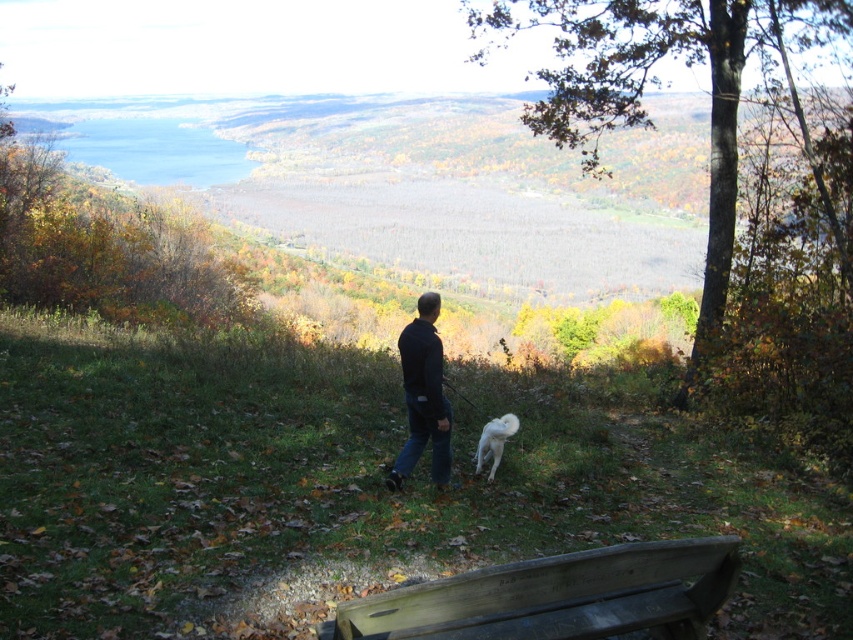
Question: Is black fabric jacket at center to the left of white fluffy dog at center from the viewer's perspective?

Choices:
 (A) yes
 (B) no

Answer: (A)

Question: Which point is farther to the camera?

Choices:
 (A) (508, 424)
 (B) (451, 580)
 (C) (405, 397)

Answer: (A)

Question: Is wooden bench at lower center thinner than black fabric jacket at center?

Choices:
 (A) no
 (B) yes

Answer: (A)

Question: Based on their relative distances, which object is farther from the black fabric jacket at center?

Choices:
 (A) wooden bench at lower center
 (B) white fluffy dog at center

Answer: (A)

Question: Does wooden bench at lower center have a lesser width compared to white fluffy dog at center?

Choices:
 (A) no
 (B) yes

Answer: (A)

Question: Among these objects, which one is nearest to the camera?

Choices:
 (A) white fluffy dog at center
 (B) black fabric jacket at center

Answer: (B)